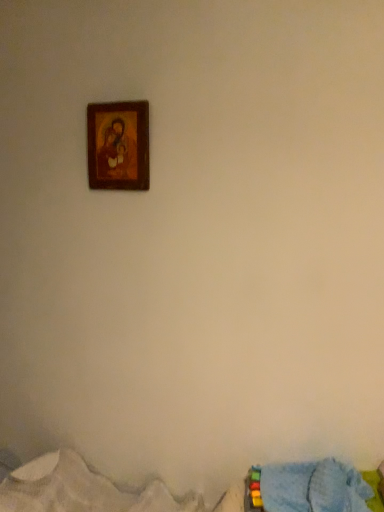
Question: Is blue textured blanket at lower right, arranged as the first bed when ordered from the bottom, to the left or to the right of wooden frame at upper center in the image?

Choices:
 (A) left
 (B) right

Answer: (B)

Question: From a real-world perspective, relative to wooden frame at upper center, is blue textured blanket at lower right, which is counted as the second bed, starting from the top, vertically above or below?

Choices:
 (A) above
 (B) below

Answer: (B)

Question: Which object is the farthest from the blue fabric bed at lower right, marked as the 1th bed in a top-to-bottom arrangement?

Choices:
 (A) blue textured blanket at lower right, arranged as the first bed when ordered from the bottom
 (B) wooden frame at upper center

Answer: (B)

Question: Estimate the real-world distances between objects in this image. Which object is farther from the blue textured blanket at lower right, which is counted as the second bed, starting from the top?

Choices:
 (A) wooden frame at upper center
 (B) blue fabric bed at lower right, which is the second bed from bottom to top

Answer: (A)